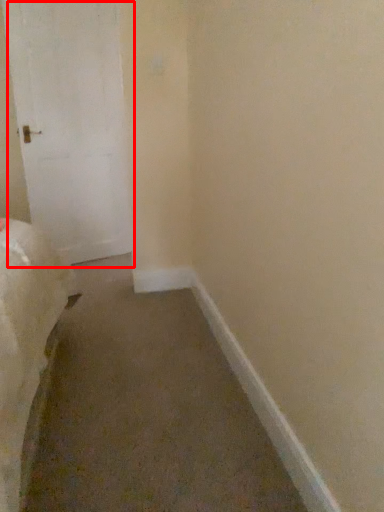
Question: In this image, where is door (annotated by the red box) located relative to molding?

Choices:
 (A) right
 (B) left

Answer: (B)